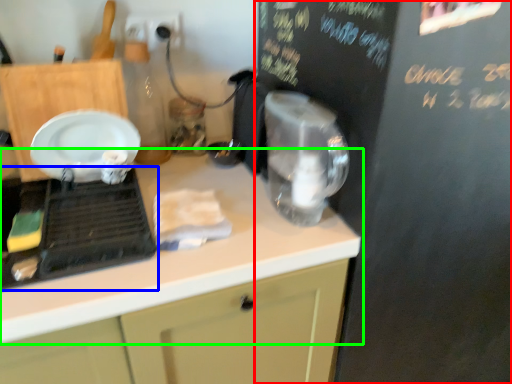
Question: Which is nearer to the bulletin board (highlighted by a red box)? home appliance (highlighted by a blue box) or countertop (highlighted by a green box).

Choices:
 (A) home appliance
 (B) countertop

Answer: (B)